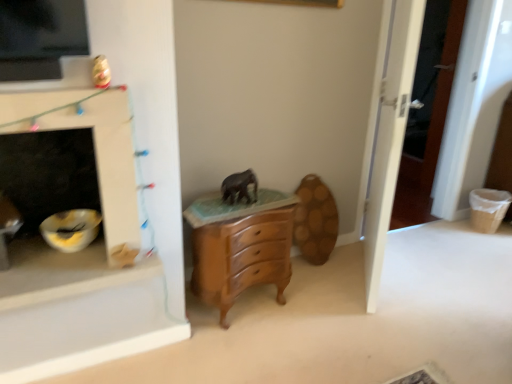
Locate an element on the screen. unoccupied area in front of wooden chest of drawers at center is located at coordinates (240, 347).